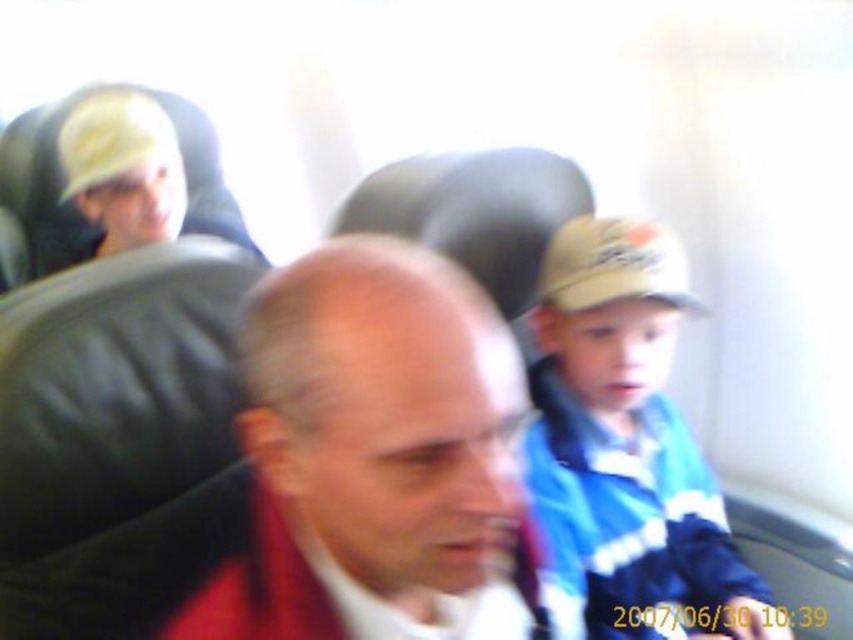
You are a passenger in an airplane cabin. You notice a point at coordinate (376, 458). What object is located at that point?

The point at coordinate (376, 458) corresponds to the smooth red shirt at center.

You are a passenger on an airplane and you want to locate the smooth red shirt at center. Where exactly is it located in the cabin?

The smooth red shirt at center is located at point coordinates of [376,458] in the cabin.